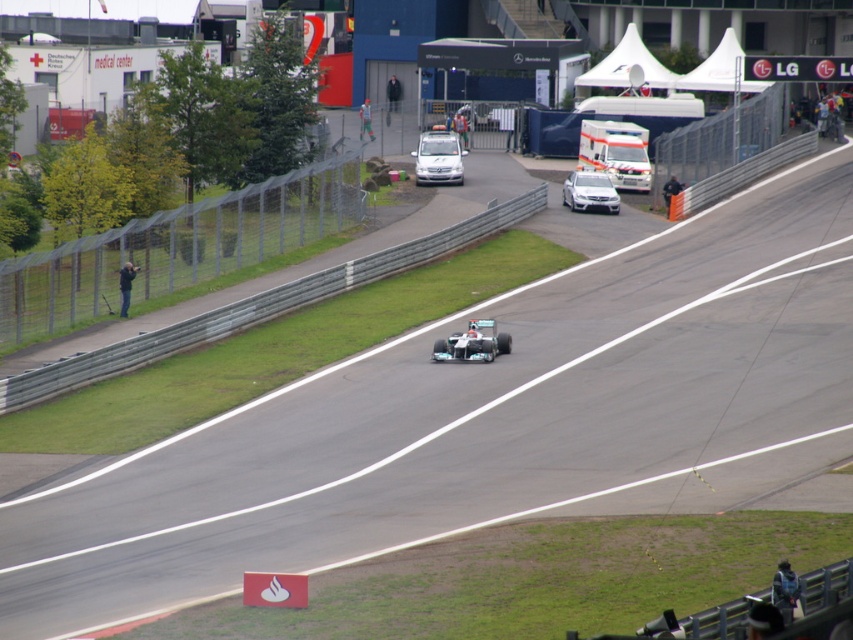
Question: Observing the image, what is the correct spatial positioning of white matte race car at center in reference to satin silver sedan at center?

Choices:
 (A) left
 (B) right

Answer: (A)

Question: Considering the relative positions of white matte van at center and satin silver sedan at center in the image provided, where is white matte van at center located with respect to satin silver sedan at center?

Choices:
 (A) left
 (B) right

Answer: (A)

Question: Which point is farther from the camera taking this photo?

Choices:
 (A) (509, 352)
 (B) (606, 205)

Answer: (B)

Question: Is white matte van at center positioned at the back of white matte race car at center?

Choices:
 (A) yes
 (B) no

Answer: (A)

Question: Which of the following is the closest to the observer?

Choices:
 (A) white matte race car at center
 (B) white matte van at center

Answer: (A)

Question: Which of the following is the farthest from the observer?

Choices:
 (A) satin silver sedan at center
 (B) white matte van at center

Answer: (B)